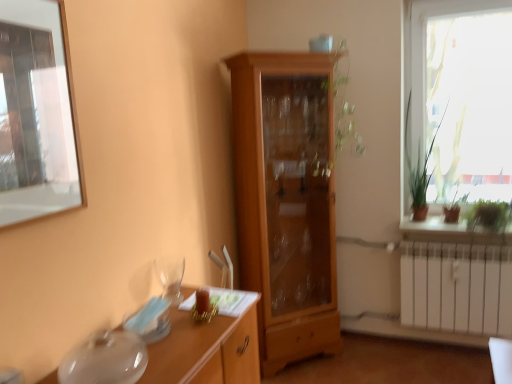
Question: From the image's perspective, would you say green leafy plant at right, the first plant from the right, is shown under green matte plant at right?

Choices:
 (A) yes
 (B) no

Answer: (B)

Question: Is green leafy plant at right, the first plant from the right, at the right side of green matte plant at right?

Choices:
 (A) no
 (B) yes

Answer: (B)

Question: Is green leafy plant at right, the second plant from the left, surrounding green matte plant at right?

Choices:
 (A) no
 (B) yes

Answer: (B)

Question: Is green leafy plant at right, the second plant from the left, wider than green matte plant at right?

Choices:
 (A) yes
 (B) no

Answer: (B)

Question: Can you confirm if green leafy plant at right, the second plant from the left, is shorter than green matte plant at right?

Choices:
 (A) no
 (B) yes

Answer: (A)

Question: Considering the positions of transparent glass window screen at upper left and transparent glass window at right in the image, is transparent glass window screen at upper left bigger or smaller than transparent glass window at right?

Choices:
 (A) big
 (B) small

Answer: (B)

Question: From a real-world perspective, is transparent glass window screen at upper left above or below transparent glass window at right?

Choices:
 (A) above
 (B) below

Answer: (A)

Question: Is transparent glass window screen at upper left in front of or behind transparent glass window at right in the image?

Choices:
 (A) front
 (B) behind

Answer: (A)

Question: Is transparent glass window screen at upper left situated inside transparent glass window at right or outside?

Choices:
 (A) inside
 (B) outside

Answer: (B)

Question: Do you think green matte plant at right is within green leafy plant at right, the first plant from the right, or outside of it?

Choices:
 (A) inside
 (B) outside

Answer: (A)

Question: Looking at their shapes, would you say green matte plant at right is wider or thinner than green leafy plant at right, the second plant from the left?

Choices:
 (A) thin
 (B) wide

Answer: (B)

Question: In the image, is green matte plant at right positioned in front of or behind green leafy plant at right, the first plant from the right?

Choices:
 (A) behind
 (B) front

Answer: (A)

Question: Considering the positions of green matte plant at right and green leafy plant at right, the first plant from the right, in the image, is green matte plant at right taller or shorter than green leafy plant at right, the first plant from the right,?

Choices:
 (A) short
 (B) tall

Answer: (A)

Question: In terms of height, does clear glass wine glass at lower left look taller or shorter compared to green leafy plant at right, the second plant from the left?

Choices:
 (A) short
 (B) tall

Answer: (A)

Question: Is point (179, 299) positioned closer to the camera than point (486, 200)?

Choices:
 (A) closer
 (B) farther

Answer: (A)